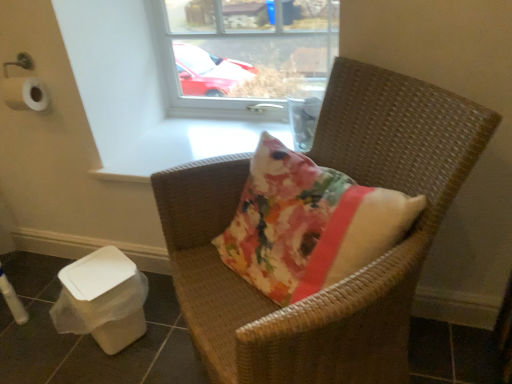
What is the approximate height of woven brown chair at center?

33.92 inches.

At what (x,y) coordinates should I click in order to perform the action: click on transparent glass window at upper center. Please return your answer as a coordinate pair (x, y). The image size is (512, 384). Looking at the image, I should click on (238, 47).

Where is `woven brown chair at center`? The image size is (512, 384). woven brown chair at center is located at coordinates tap(352, 276).

Locate an element on the screen. This screenshot has height=384, width=512. potty below the transparent glass window at upper center (from the image's perspective) is located at coordinates (102, 299).

From the image's perspective, would you say transparent glass window at upper center is shown under white plastic potty at lower left?

No.

Is point (328, 72) closer to viewer compared to point (141, 324)?

No, (328, 72) is behind (141, 324).

From a real-world perspective, who is located lower, transparent glass window at upper center or white plastic potty at lower left?

In real-world perspective, white plastic potty at lower left is lower.

Is white plastic potty at lower left shorter than transparent glass window at upper center?

Indeed, white plastic potty at lower left has a lesser height compared to transparent glass window at upper center.

How many degrees apart are the facing directions of white plastic potty at lower left and transparent glass window at upper center?

They differ by 30 degrees in their facing directions.

Would you say white plastic potty at lower left is inside or outside transparent glass window at upper center?

white plastic potty at lower left is outside transparent glass window at upper center.

Consider the image. Is transparent glass window at upper center next to woven brown chair at center and touching it?

No, transparent glass window at upper center is not in contact with woven brown chair at center.

Which object is more forward, transparent glass window at upper center or woven brown chair at center?

woven brown chair at center is closer to the camera.

From a real-world perspective, is transparent glass window at upper center positioned above or below woven brown chair at center?

In terms of real-world spatial position, transparent glass window at upper center is above woven brown chair at center.

Does transparent glass window at upper center appear on the left side of woven brown chair at center?

Correct, you'll find transparent glass window at upper center to the left of woven brown chair at center.

Consider the image. Is woven brown chair at center surrounding transparent glass window at upper center?

No, transparent glass window at upper center is not inside woven brown chair at center.

Which of these two, woven brown chair at center or transparent glass window at upper center, is bigger?

Bigger between the two is woven brown chair at center.

From a real-world perspective, who is located higher, woven brown chair at center or transparent glass window at upper center?

transparent glass window at upper center is physically above.

Considering the positions of objects woven brown chair at center and transparent glass window at upper center in the image provided, who is more to the right, woven brown chair at center or transparent glass window at upper center?

Positioned to the right is woven brown chair at center.

Where is `chair above the white plastic potty at lower left (from a real-world perspective)`? This screenshot has width=512, height=384. chair above the white plastic potty at lower left (from a real-world perspective) is located at coordinates (352, 276).

Which of these two, woven brown chair at center or white plastic potty at lower left, is bigger?

With larger size is woven brown chair at center.

Do you think woven brown chair at center is within white plastic potty at lower left, or outside of it?

woven brown chair at center is not inside white plastic potty at lower left, it's outside.

Can you tell me how much white plastic potty at lower left and woven brown chair at center differ in facing direction?

The angle between the facing direction of white plastic potty at lower left and the facing direction of woven brown chair at center is 16.4 degrees.

Between point (123, 261) and point (397, 102), which one is positioned in front?

The point (397, 102) is in front.

Between white plastic potty at lower left and woven brown chair at center, which one has more height?

woven brown chair at center is taller.

Looking at the image, does white plastic potty at lower left seem bigger or smaller compared to woven brown chair at center?

Clearly, white plastic potty at lower left is smaller in size than woven brown chair at center.

At what (x,y) coordinates should I click in order to perform the action: click on potty on the left of transparent glass window at upper center. Please return your answer as a coordinate pair (x, y). Looking at the image, I should click on (102, 299).

Where is `potty below the transparent glass window at upper center (from the image's perspective)`? Image resolution: width=512 pixels, height=384 pixels. potty below the transparent glass window at upper center (from the image's perspective) is located at coordinates (x=102, y=299).

Which object lies further to the anchor point transparent glass window at upper center, woven brown chair at center or white plastic potty at lower left?

Answer: white plastic potty at lower left.

In the scene shown: From the image, which object appears to be farther from transparent glass window at upper center, white plastic potty at lower left or woven brown chair at center?

The object further to transparent glass window at upper center is white plastic potty at lower left.

Based on their spatial positions, is transparent glass window at upper center or white plastic potty at lower left further from woven brown chair at center?

transparent glass window at upper center is further to woven brown chair at center.

Considering their positions, is woven brown chair at center positioned further to white plastic potty at lower left than transparent glass window at upper center?

transparent glass window at upper center is positioned further to the anchor white plastic potty at lower left.

When comparing their distances from woven brown chair at center, does white plastic potty at lower left or transparent glass window at upper center seem closer?

white plastic potty at lower left.

When comparing their distances from white plastic potty at lower left, does transparent glass window at upper center or woven brown chair at center seem closer?

woven brown chair at center lies closer to white plastic potty at lower left than the other object.

In order to click on potty positioned between woven brown chair at center and transparent glass window at upper center from near to far in this screenshot , I will do `click(102, 299)`.